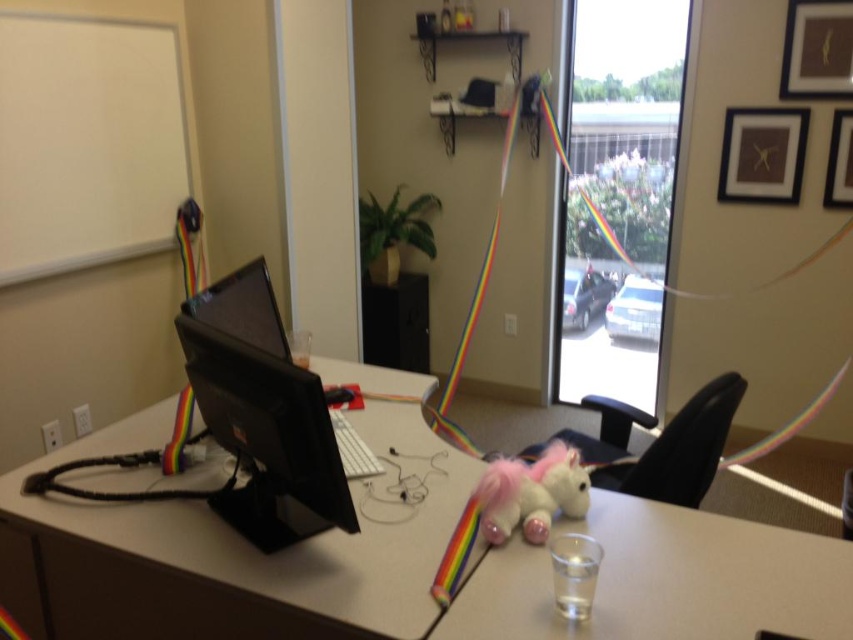
You are organizing the desk items and need to place a new item between the black glossy monitor at center and the plush pink unicorn at center. Based on their current positions, which object should be on the left side of the new item?

The black glossy monitor at center is positioned on the left side of plush pink unicorn at center, so the new item should be placed between them with the monitor to its left and the unicorn to its right.

You are organizing a tech event and need to set up two monitors on a desk. You have a matte black monitor at center and a black glossy monitor at center. According to the image, which monitor should you place closer to the audience to ensure better visibility?

The matte black monitor at center is closer to the viewer than the black glossy monitor at center, so placing the matte black monitor at center closer to the audience would ensure better visibility as it is already positioned nearer in the setup.

You are organizing a desk and need to place a new item between the black glossy monitor at center and the plush pink unicorn at center. Which object should you place the item closer to if you want it to be closer to the taller object?

The black glossy monitor at center is taller than the plush pink unicorn at center. Therefore, placing the item closer to the black glossy monitor at center would ensure it is near the taller object.